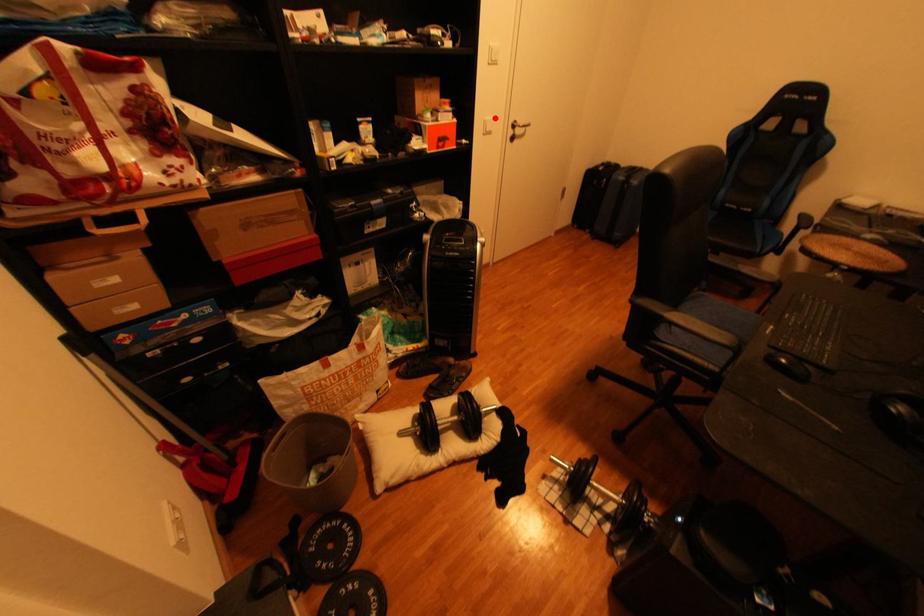
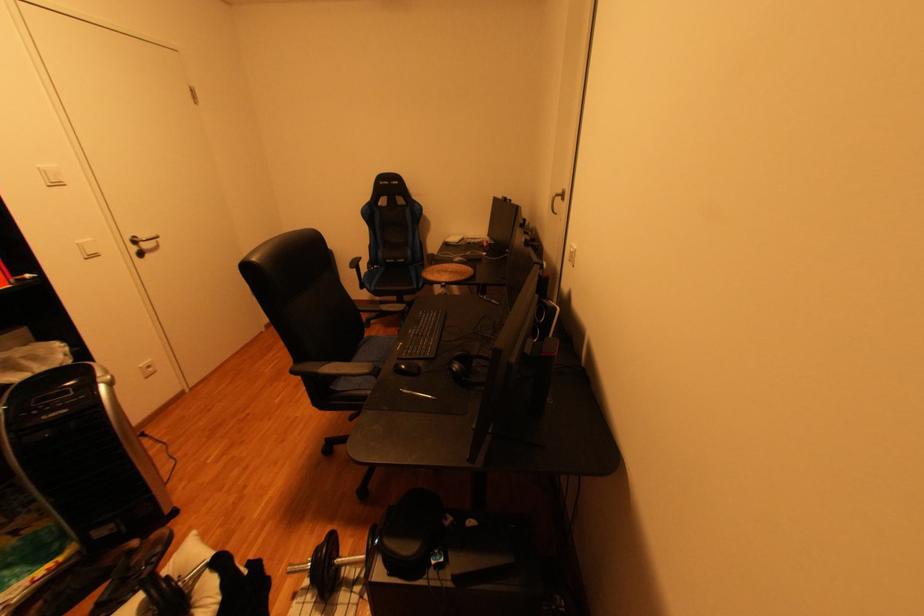
Question: I am providing you with two images of the same scene from different viewpoints. Given a red point in image1, look at the same physical point in image2. Is it:

Choices:
 (A) Closer to the viewpoint
 (B) Farther from the viewpoint

Answer: (B)